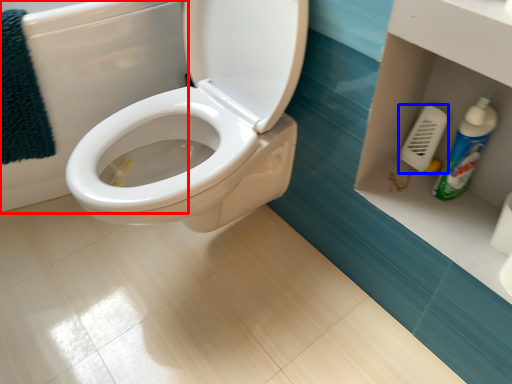
Question: Which object appears farthest to the camera in this image, bath (highlighted by a red box) or towel bar (highlighted by a blue box)?

Choices:
 (A) bath
 (B) towel bar

Answer: (B)